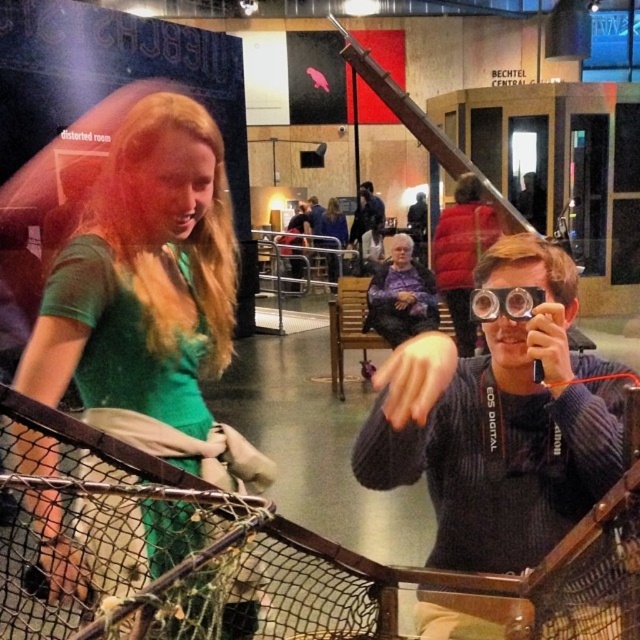
You are standing in the museum and want to touch the green matte shirt at center. Can you reach it without moving closer?

The green matte shirt at center is 36.15 inches away from the viewer, so yes, you can reach it without moving closer.

You are standing in the museum and see two points marked in the image. The first point is at coordinates point (164,250) and the second is at point (596,634). Which point is closer to you?

Point (164,250) is behind point (596,634), so the second point is closer to you.

You are a visitor in the museum and want to take a closer look at the exhibit. The green matte shirt at center and transparent plastic goggles at center are in your way. Which object should you move first to get a better view?

The green matte shirt at center is positioned under transparent plastic goggles at center, so you should move the transparent plastic goggles at center first to get a better view.